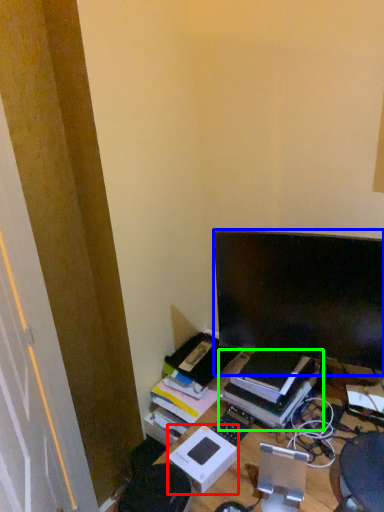
Question: Which object is positioned farthest from cardboard box (highlighted by a red box)? Select from computer monitor (highlighted by a blue box) and book (highlighted by a green box).

Choices:
 (A) computer monitor
 (B) book

Answer: (A)